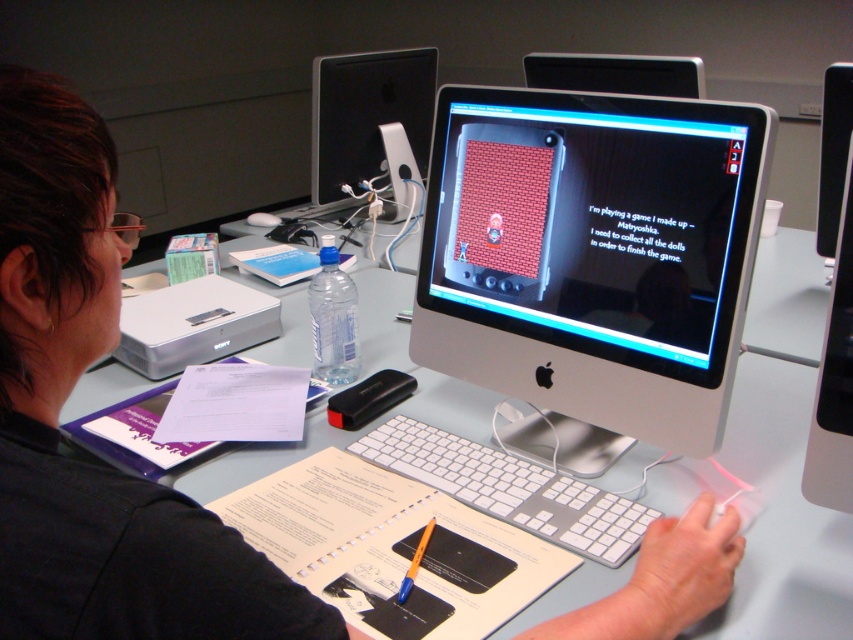
Who is more distant from viewer, (636,90) or (325,307)?

Positioned behind is point (636,90).

Does point (700, 81) lie behind point (328, 358)?

That is True.

Where is `black glossy monitor at upper center`? The image size is (853, 640). black glossy monitor at upper center is located at coordinates (616, 74).

Can you confirm if satin black monitor at upper center is shorter than clear plastic bottle at center?

No.

Which is below, satin black monitor at upper center or clear plastic bottle at center?

clear plastic bottle at center is lower down.

You are a GUI agent. You are given a task and a screenshot of the screen. Output one action in this format:
    pyautogui.click(x=<x>, y=<y>)
    Task: Click on the satin black monitor at upper center
    The image size is (853, 640).
    Given the screenshot: What is the action you would take?
    pyautogui.click(x=366, y=115)

The width and height of the screenshot is (853, 640). Identify the location of satin black monitor at upper center. (366, 115).

Between white plastic keyboard at center and satin black monitor at upper center, which one is positioned higher?

satin black monitor at upper center

Is white plastic keyboard at center above satin black monitor at upper center?

No.

Between point (540, 493) and point (315, 124), which one is positioned in front?

Point (540, 493)

Where is `white plastic keyboard at center`? white plastic keyboard at center is located at coordinates (509, 488).